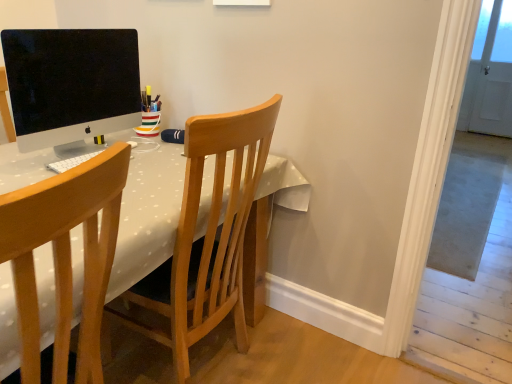
Question: Does white dotted fabric table at center turn towards white matte keyboard at center?

Choices:
 (A) no
 (B) yes

Answer: (A)

Question: Can you confirm if white dotted fabric table at center is taller than white matte keyboard at center?

Choices:
 (A) yes
 (B) no

Answer: (A)

Question: Is white dotted fabric table at center looking in the opposite direction of white matte keyboard at center?

Choices:
 (A) yes
 (B) no

Answer: (B)

Question: Are white dotted fabric table at center and white matte keyboard at center located far from each other?

Choices:
 (A) yes
 (B) no

Answer: (B)

Question: Is white dotted fabric table at center surrounding white matte keyboard at center?

Choices:
 (A) no
 (B) yes

Answer: (B)

Question: Is white matte keyboard at center taller or shorter than wooden chair at left, placed as the 2th chair when sorted from back to front?

Choices:
 (A) short
 (B) tall

Answer: (A)

Question: In the image, is white matte keyboard at center positioned in front of or behind wooden chair at left, placed as the 2th chair when sorted from back to front?

Choices:
 (A) behind
 (B) front

Answer: (A)

Question: From the image's perspective, relative to wooden chair at left, placed as the 2th chair when sorted from back to front, is white matte keyboard at center above or below?

Choices:
 (A) above
 (B) below

Answer: (A)

Question: Is white matte keyboard at center inside or outside of wooden chair at left, the first chair viewed from the front?

Choices:
 (A) inside
 (B) outside

Answer: (B)

Question: Visually, is wooden chair at center, marked as the 2th chair in a front-to-back arrangement, positioned to the left or to the right of white dotted fabric table at center?

Choices:
 (A) left
 (B) right

Answer: (B)

Question: Is wooden chair at center, which is the 1th chair in back-to-front order, inside or outside of white dotted fabric table at center?

Choices:
 (A) outside
 (B) inside

Answer: (B)

Question: Is wooden chair at center, marked as the 2th chair in a front-to-back arrangement, bigger or smaller than white dotted fabric table at center?

Choices:
 (A) big
 (B) small

Answer: (B)

Question: Considering the positions of wooden chair at center, which is the 1th chair in back-to-front order, and white dotted fabric table at center in the image, is wooden chair at center, which is the 1th chair in back-to-front order, taller or shorter than white dotted fabric table at center?

Choices:
 (A) short
 (B) tall

Answer: (B)

Question: Choose the correct answer: Is white dotted fabric table at center inside white matte keyboard at center or outside it?

Choices:
 (A) inside
 (B) outside

Answer: (B)

Question: Relative to white matte keyboard at center, is white dotted fabric table at center in front or behind?

Choices:
 (A) behind
 (B) front

Answer: (B)